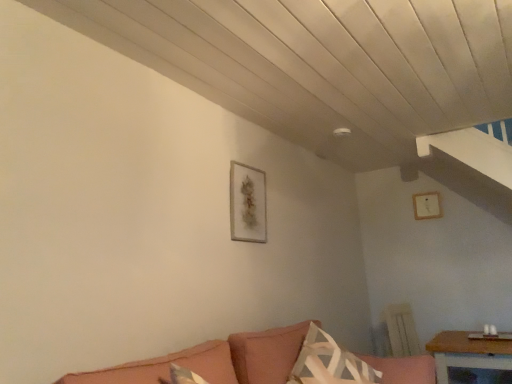
Question: In the image, is velvet pink couch at lower center positioned in front of or behind white textured pillow at lower center?

Choices:
 (A) behind
 (B) front

Answer: (B)

Question: Considering the positions of velvet pink couch at lower center and white textured pillow at lower center in the image, is velvet pink couch at lower center bigger or smaller than white textured pillow at lower center?

Choices:
 (A) big
 (B) small

Answer: (A)

Question: Which of these objects is positioned closest to the wooden picture frame at upper right, the first picture frame in the back-to-front sequence?

Choices:
 (A) velvet pink couch at lower center
 (B) white textured pillow at lower center
 (C) matte gold picture frame at center, marked as the first picture frame in a front-to-back arrangement
 (D) wooden table at lower right

Answer: (D)

Question: Which object is positioned farthest from the white textured pillow at lower center?

Choices:
 (A) matte gold picture frame at center, which ranks as the 2th picture frame in back-to-front order
 (B) wooden table at lower right
 (C) wooden picture frame at upper right, the 1th picture frame from the right
 (D) velvet pink couch at lower center

Answer: (C)